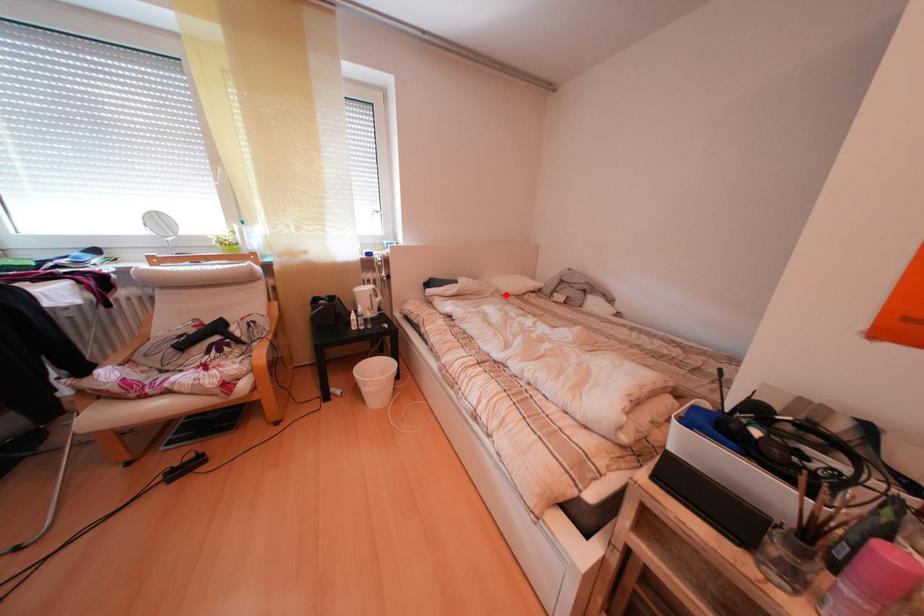
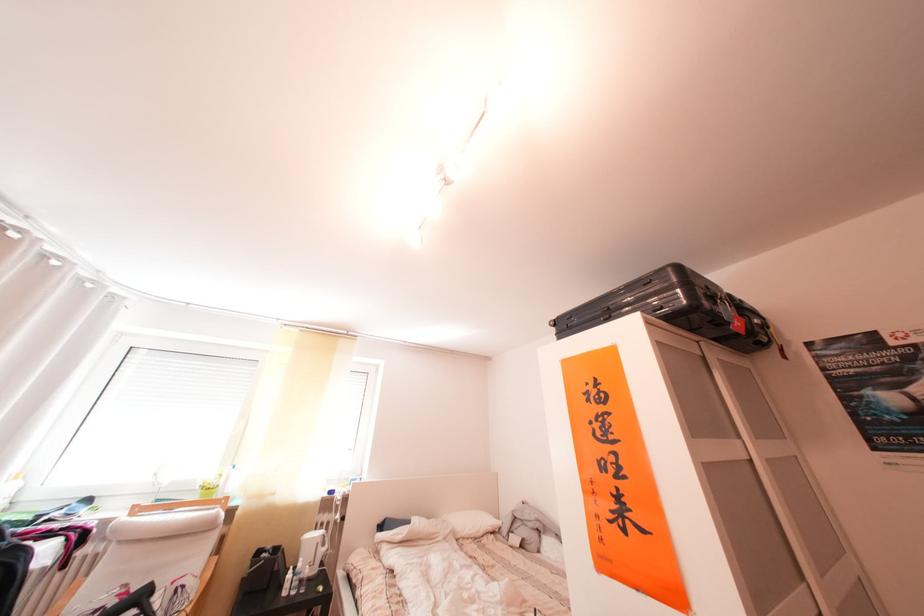
The point at the highlighted location is marked in the first image. Where is the corresponding point in the second image?

(459, 537)